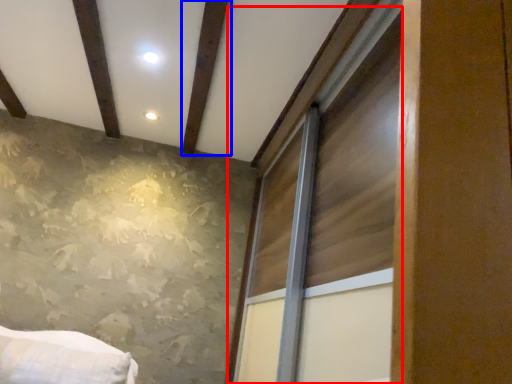
Question: Which object is further to the camera taking this photo, window (highlighted by a red box) or plank (highlighted by a blue box)?

Choices:
 (A) window
 (B) plank

Answer: (B)